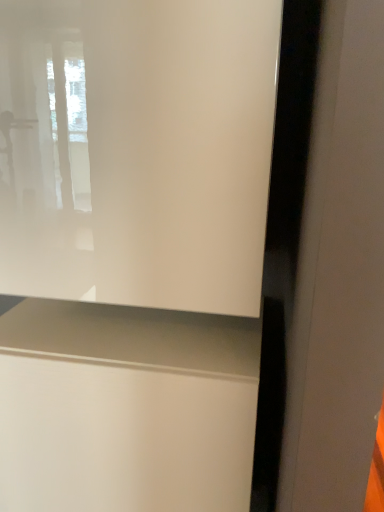
Image resolution: width=384 pixels, height=512 pixels. Describe the element at coordinates (125, 407) in the screenshot. I see `matte white vanity at lower center` at that location.

This screenshot has height=512, width=384. I want to click on matte white vanity at lower center, so click(x=125, y=407).

Measure the distance between matte white vanity at lower center and camera.

matte white vanity at lower center and camera are 29.92 inches apart from each other.

In order to face transparent glass window at upper left, should I rotate leftwards or rightwards?

You should look left and rotate roughly 9.403 degrees.

The height and width of the screenshot is (512, 384). What do you see at coordinates (138, 150) in the screenshot?
I see `transparent glass window at upper left` at bounding box center [138, 150].

Identify the location of transparent glass window at upper left. The height and width of the screenshot is (512, 384). (138, 150).

Looking at this image, measure the distance between point (199, 119) and camera.

Point (199, 119) is 25.39 inches away from camera.

This screenshot has width=384, height=512. I want to click on matte white vanity at lower center, so click(x=125, y=407).

Considering the positions of objects transparent glass window at upper left and matte white vanity at lower center in the image provided, who is more to the left, transparent glass window at upper left or matte white vanity at lower center?

From the viewer's perspective, matte white vanity at lower center appears more on the left side.

Is the depth of transparent glass window at upper left less than that of matte white vanity at lower center?

Yes, transparent glass window at upper left is in front of matte white vanity at lower center.

Is point (156, 92) in front of point (92, 433)?

That is True.

From the image's perspective, which is below, transparent glass window at upper left or matte white vanity at lower center?

matte white vanity at lower center is shown below in the image.

In the scene shown: From a real-world perspective, is transparent glass window at upper left positioned above or below matte white vanity at lower center?

Clearly, from a real-world perspective, transparent glass window at upper left is above matte white vanity at lower center.

Which object is wider, transparent glass window at upper left or matte white vanity at lower center?

With larger width is matte white vanity at lower center.

Considering the relative sizes of transparent glass window at upper left and matte white vanity at lower center in the image provided, is transparent glass window at upper left taller than matte white vanity at lower center?

In fact, transparent glass window at upper left may be shorter than matte white vanity at lower center.

Between transparent glass window at upper left and matte white vanity at lower center, which one has larger size?

matte white vanity at lower center.

Is transparent glass window at upper left outside of matte white vanity at lower center?

That's correct, transparent glass window at upper left is outside of matte white vanity at lower center.

Would you consider transparent glass window at upper left to be distant from matte white vanity at lower center?

Actually, transparent glass window at upper left and matte white vanity at lower center are a little close together.

Could you tell me if transparent glass window at upper left is turned towards matte white vanity at lower center?

No, transparent glass window at upper left is not oriented towards matte white vanity at lower center.

Can you tell me how much transparent glass window at upper left and matte white vanity at lower center differ in facing direction?

The facing directions of transparent glass window at upper left and matte white vanity at lower center are 0.000559 degrees apart.

The width and height of the screenshot is (384, 512). I want to click on vanity below the transparent glass window at upper left (from the image's perspective), so click(125, 407).

Considering the relative positions of matte white vanity at lower center and transparent glass window at upper left in the image provided, is matte white vanity at lower center to the left or to the right of transparent glass window at upper left?

From the image, it's evident that matte white vanity at lower center is to the left of transparent glass window at upper left.

Which object is more forward, matte white vanity at lower center or transparent glass window at upper left?

Positioned in front is transparent glass window at upper left.

Which is in front, point (209, 384) or point (227, 274)?

The point (227, 274) is more forward.

From the image's perspective, is matte white vanity at lower center under transparent glass window at upper left?

Yes.

From the picture: From a real-world perspective, between matte white vanity at lower center and transparent glass window at upper left, who is vertically lower?

matte white vanity at lower center, from a real-world perspective.

Which object is thinner, matte white vanity at lower center or transparent glass window at upper left?

transparent glass window at upper left is thinner.

Considering the relative sizes of matte white vanity at lower center and transparent glass window at upper left in the image provided, is matte white vanity at lower center shorter than transparent glass window at upper left?

Incorrect, the height of matte white vanity at lower center does not fall short of that of transparent glass window at upper left.

Is matte white vanity at lower center smaller than transparent glass window at upper left?

Actually, matte white vanity at lower center might be larger than transparent glass window at upper left.

Can transparent glass window at upper left be found inside matte white vanity at lower center?

No, matte white vanity at lower center does not contain transparent glass window at upper left.

Would you say matte white vanity at lower center is a long distance from transparent glass window at upper left?

That's not correct — matte white vanity at lower center is a little close to transparent glass window at upper left.

Is matte white vanity at lower center oriented away from transparent glass window at upper left?

No, matte white vanity at lower center is not facing away from transparent glass window at upper left.

At what (x,y) coordinates should I click in order to perform the action: click on window above the matte white vanity at lower center (from a real-world perspective). Please return your answer as a coordinate pair (x, y). This screenshot has height=512, width=384. Looking at the image, I should click on tap(138, 150).

Locate an element on the screen. Image resolution: width=384 pixels, height=512 pixels. window lying above the matte white vanity at lower center (from the image's perspective) is located at coordinates (138, 150).

Locate an element on the screen. window located on the right of matte white vanity at lower center is located at coordinates (138, 150).